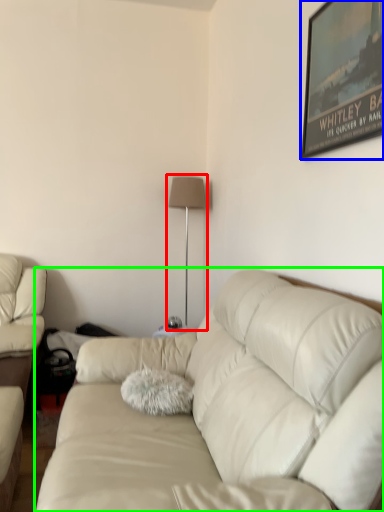
Question: Which object is the farthest from table lamp (highlighted by a red box)? Choose among these: picture frame (highlighted by a blue box) or studio couch (highlighted by a green box).

Choices:
 (A) picture frame
 (B) studio couch

Answer: (B)